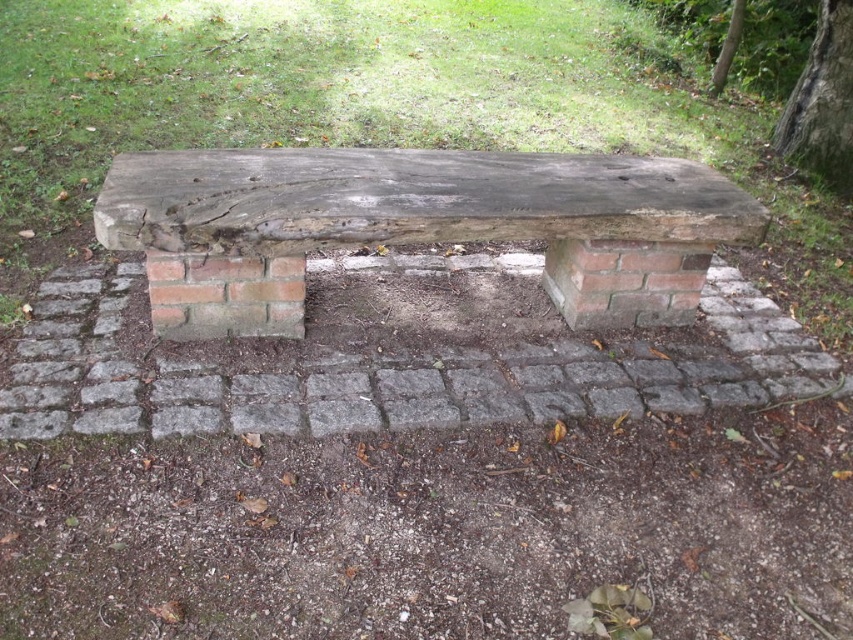
Does weathered wood bench at center appear on the right side of green leafy tree at upper right?

In fact, weathered wood bench at center is to the left of green leafy tree at upper right.

Who is more forward, [200,259] or [722,48]?

Point [200,259] is in front.

Where is `weathered wood bench at center`? This screenshot has height=640, width=853. weathered wood bench at center is located at coordinates click(x=415, y=227).

Which is more to the right, green rough bark at upper right or green leafy tree at upper right?

Positioned to the right is green leafy tree at upper right.

Between point (817, 68) and point (727, 38), which one is positioned behind?

The point (727, 38) is more distant.

Find the location of a particular element. green rough bark at upper right is located at coordinates (822, 104).

Is point (288, 273) more distant than point (834, 28)?

No, it is not.

Which is below, weathered wood bench at center or green rough bark at upper right?

Positioned lower is weathered wood bench at center.

Locate an element on the screen. The image size is (853, 640). weathered wood bench at center is located at coordinates (415, 227).

Find the location of a particular element. weathered wood bench at center is located at coordinates (415, 227).